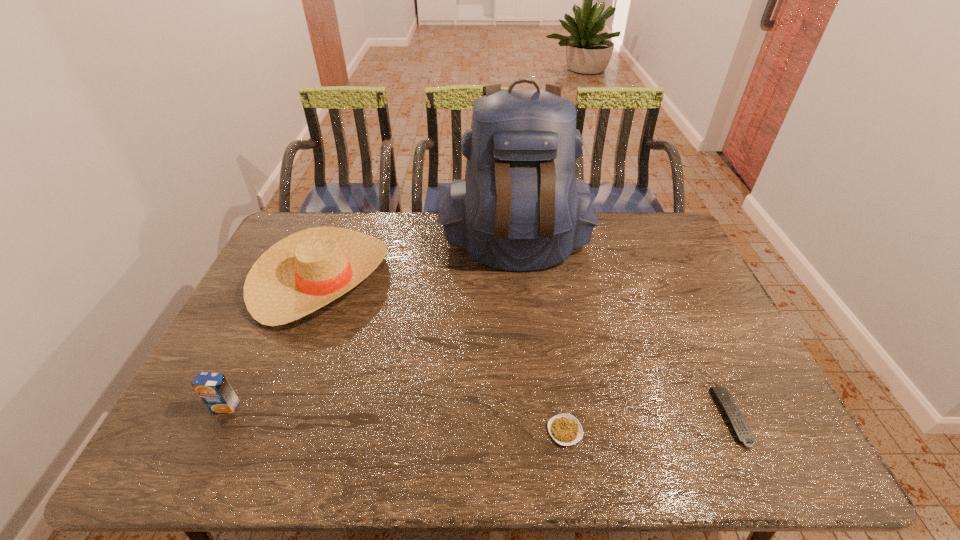
This screenshot has width=960, height=540. I want to click on backpack, so click(520, 207).

The height and width of the screenshot is (540, 960). Identify the location of sunhat. (305, 271).

I want to click on orange_juice, so point(213,388).

Where is `the rightmost object`? This screenshot has height=540, width=960. the rightmost object is located at coordinates (722, 395).

Where is `legume`? The image size is (960, 540). legume is located at coordinates (565, 429).

At what (x,y) coordinates should I click in order to perform the action: click on free space located at the front pocket of the backpack. Please return your answer as a coordinate pair (x, y). Looking at the image, I should click on (524, 309).

Find the location of a particular element. The image size is (960, 540). blank space located 0.100m on the back of the sunhat is located at coordinates (345, 220).

Locate an element on the screen. free space located on the back of the orange_juice is located at coordinates (273, 309).

Locate an element on the screen. This screenshot has width=960, height=540. free space located on the back of the remote control is located at coordinates (708, 369).

Identify the location of vacant space located 0.070m on the left of the shortest object. (517, 431).